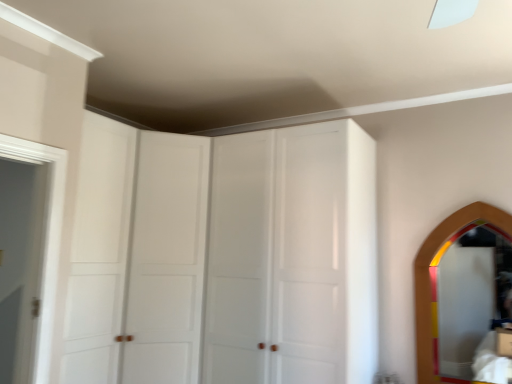
Question: Which direction should I rotate to look at white glossy cabinet doors at upper center, positioned as the first glass door in left-to-right order?

Choices:
 (A) right
 (B) left

Answer: (B)

Question: Is white wooden door at left wider than wooden mirror at right?

Choices:
 (A) yes
 (B) no

Answer: (A)

Question: From the image's perspective, is white wooden door at left located above wooden mirror at right?

Choices:
 (A) yes
 (B) no

Answer: (A)

Question: Is white wooden door at left to the left of wooden mirror at right from the viewer's perspective?

Choices:
 (A) yes
 (B) no

Answer: (A)

Question: Does white wooden door at left have a smaller size compared to wooden mirror at right?

Choices:
 (A) yes
 (B) no

Answer: (A)

Question: Is white wooden door at left bigger than wooden mirror at right?

Choices:
 (A) no
 (B) yes

Answer: (A)

Question: From the image's perspective, would you say white wooden door at left is shown under wooden mirror at right?

Choices:
 (A) yes
 (B) no

Answer: (B)

Question: From a real-world perspective, is white glossy cabinet at center, positioned as the 2th glass door in left-to-right order, positioned under wooden mirror at right based on gravity?

Choices:
 (A) no
 (B) yes

Answer: (A)

Question: Is wooden mirror at right surrounded by white glossy cabinet at center, arranged as the first glass door when viewed from the right?

Choices:
 (A) no
 (B) yes

Answer: (A)

Question: Is the position of white glossy cabinet at center, positioned as the 2th glass door in left-to-right order, less distant than that of wooden mirror at right?

Choices:
 (A) yes
 (B) no

Answer: (A)

Question: Is white glossy cabinet at center, arranged as the first glass door when viewed from the right, not inside wooden mirror at right?

Choices:
 (A) yes
 (B) no

Answer: (A)

Question: Is white glossy cabinet at center, positioned as the 2th glass door in left-to-right order, positioned with its back to wooden mirror at right?

Choices:
 (A) no
 (B) yes

Answer: (A)

Question: Is white glossy cabinet at center, arranged as the first glass door when viewed from the right, directly adjacent to wooden mirror at right?

Choices:
 (A) yes
 (B) no

Answer: (B)

Question: Considering the relative sizes of wooden mirror at right and white wooden door at left in the image provided, is wooden mirror at right taller than white wooden door at left?

Choices:
 (A) yes
 (B) no

Answer: (A)